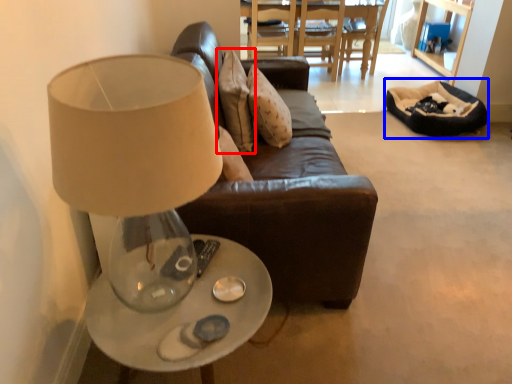
Question: Which object appears farthest to the camera in this image, pillow (highlighted by a red box) or bean bag chair (highlighted by a blue box)?

Choices:
 (A) pillow
 (B) bean bag chair

Answer: (B)